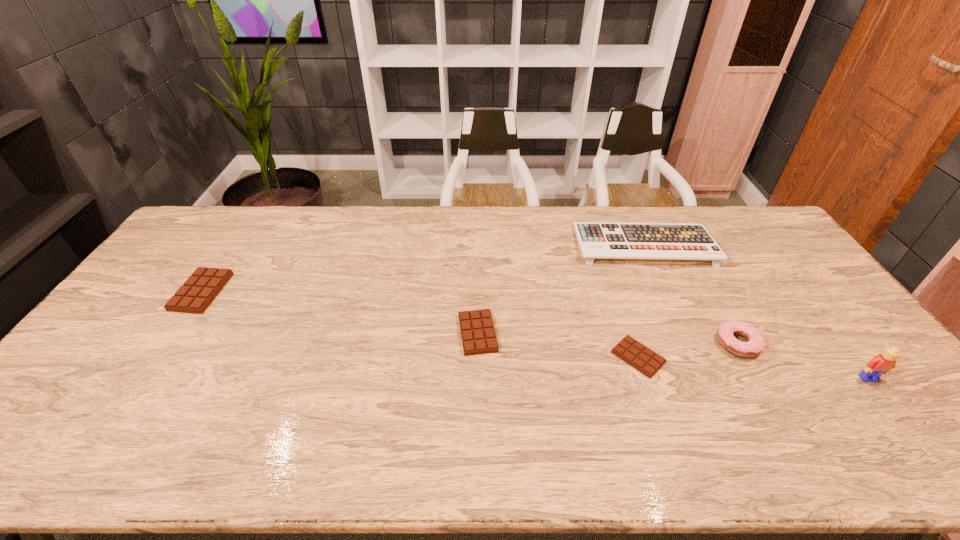
Where is `free spot between the tallest candy bar and the rightmost object`? Image resolution: width=960 pixels, height=540 pixels. free spot between the tallest candy bar and the rightmost object is located at coordinates (535, 335).

This screenshot has height=540, width=960. I want to click on vacant space that's between the farthest object and the second shortest candy bar, so click(561, 289).

Where is `free spot between the Lego and the doughnut`? The image size is (960, 540). free spot between the Lego and the doughnut is located at coordinates (804, 361).

Where is `vacant area that lies between the tallest candy bar and the shortest candy bar`? This screenshot has width=960, height=540. vacant area that lies between the tallest candy bar and the shortest candy bar is located at coordinates pos(420,325).

The height and width of the screenshot is (540, 960). Find the location of `object that can be found as the closest to the computer keyboard`. object that can be found as the closest to the computer keyboard is located at coordinates pos(755,344).

The width and height of the screenshot is (960, 540). In order to click on object that stands as the fourth closest to the farthest object in this screenshot , I will do click(x=886, y=362).

The image size is (960, 540). I want to click on candy bar that is the third nearest to the computer keyboard, so click(200, 289).

Point out which candy bar is positioned as the nearest to the computer keyboard. Please provide its 2D coordinates. Your answer should be formatted as a tuple, i.e. [(x, y)], where the tuple contains the x and y coordinates of a point satisfying the conditions above.

[(634, 353)]

I want to click on free space in the image that satisfies the following two spatial constraints: 1. on the back side of the rightmost candy bar; 2. on the left side of the farthest object, so click(601, 245).

The height and width of the screenshot is (540, 960). In order to click on vacant space that satisfies the following two spatial constraints: 1. on the front side of the doughnut; 2. on the left side of the second object from left to right in this screenshot , I will do `click(478, 344)`.